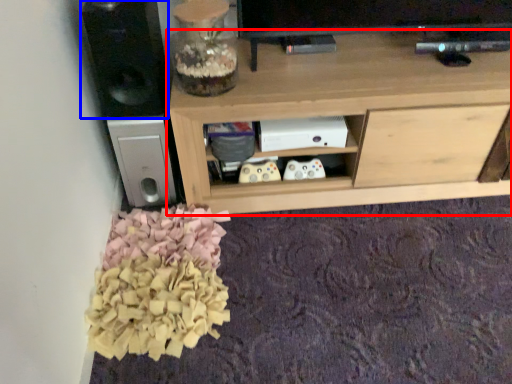
Question: Which object is further to the camera taking this photo, shelf (highlighted by a red box) or speaker (highlighted by a blue box)?

Choices:
 (A) shelf
 (B) speaker

Answer: (A)